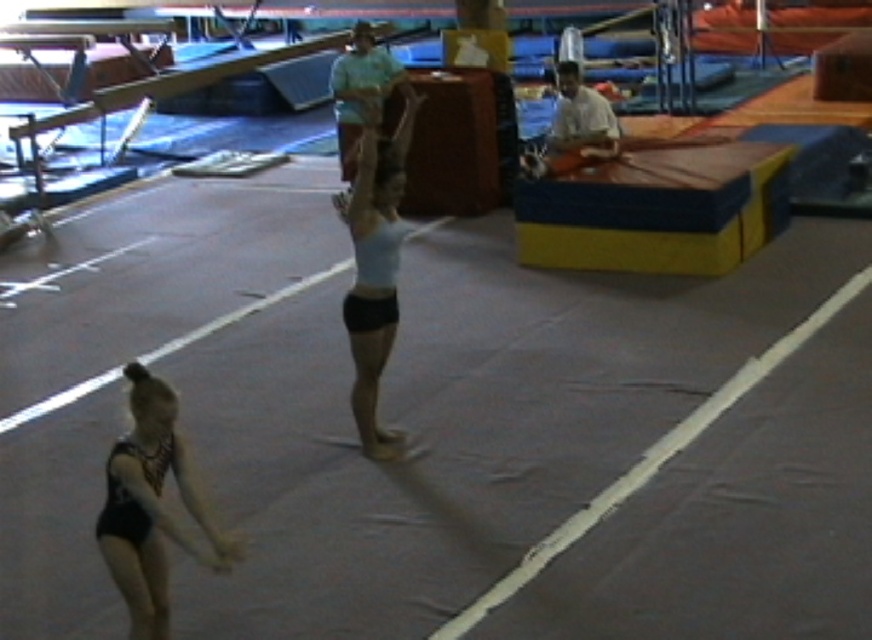
Question: Can you confirm if black leotard at lower left is smaller than light blue fabric at center?

Choices:
 (A) yes
 (B) no

Answer: (A)

Question: Is black leotard at lower left behind light blue fabric at center?

Choices:
 (A) yes
 (B) no

Answer: (B)

Question: Does black leotard at lower left appear over light blue fabric at center?

Choices:
 (A) yes
 (B) no

Answer: (B)

Question: Which of the following is the closest to the observer?

Choices:
 (A) (394, 449)
 (B) (106, 557)

Answer: (B)